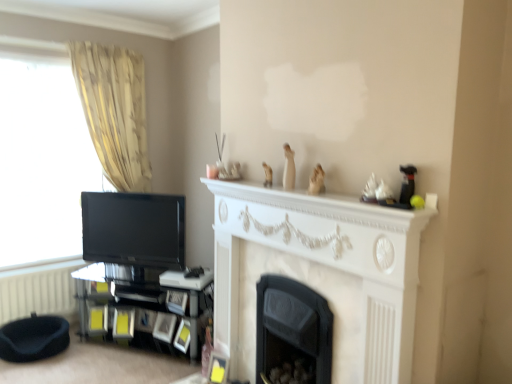
Question: From a real-world perspective, is black glossy tv at left under black fabric footrest at lower left?

Choices:
 (A) yes
 (B) no

Answer: (B)

Question: Is black glossy tv at left taller than black fabric footrest at lower left?

Choices:
 (A) yes
 (B) no

Answer: (A)

Question: From the image's perspective, is black glossy tv at left below black fabric footrest at lower left?

Choices:
 (A) no
 (B) yes

Answer: (A)

Question: Does black glossy tv at left have a greater width compared to black fabric footrest at lower left?

Choices:
 (A) no
 (B) yes

Answer: (A)

Question: Is black glossy tv at left looking in the opposite direction of black fabric footrest at lower left?

Choices:
 (A) no
 (B) yes

Answer: (A)

Question: From a real-world perspective, is white marble fireplace at center physically located above or below white textured radiator at lower left?

Choices:
 (A) above
 (B) below

Answer: (A)

Question: Is point (350, 210) closer or farther from the camera than point (12, 316)?

Choices:
 (A) closer
 (B) farther

Answer: (A)

Question: In the image, is white marble fireplace at center on the left side or the right side of white textured radiator at lower left?

Choices:
 (A) left
 (B) right

Answer: (B)

Question: Is white marble fireplace at center inside or outside of white textured radiator at lower left?

Choices:
 (A) outside
 (B) inside

Answer: (A)

Question: Would you say black matte fireplace at center, which is the 2th fireplace from front to back, is to the left or to the right of black glossy tv at left in the picture?

Choices:
 (A) left
 (B) right

Answer: (B)

Question: Is point (297, 352) closer or farther from the camera than point (128, 205)?

Choices:
 (A) farther
 (B) closer

Answer: (B)

Question: Is black matte fireplace at center, placed as the 1th fireplace when sorted from back to front, bigger or smaller than black glossy tv at left?

Choices:
 (A) small
 (B) big

Answer: (B)

Question: From a real-world perspective, is black matte fireplace at center, placed as the 1th fireplace when sorted from back to front, positioned above or below black glossy tv at left?

Choices:
 (A) below
 (B) above

Answer: (A)

Question: Is point (296, 314) positioned closer to the camera than point (45, 299)?

Choices:
 (A) farther
 (B) closer

Answer: (B)

Question: Would you say black matte fireplace at center, which is the 2th fireplace from front to back, is inside or outside white textured radiator at lower left?

Choices:
 (A) outside
 (B) inside

Answer: (A)